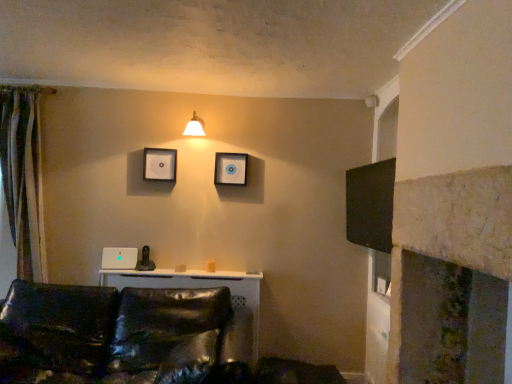
Question: In the image, is white matte picture frame at upper center, the first picture frame from the left, positioned in front of or behind shiny black leather couch at lower left?

Choices:
 (A) front
 (B) behind

Answer: (B)

Question: Choose the correct answer: Is white matte picture frame at upper center, arranged as the second picture frame when viewed from the right, inside shiny black leather couch at lower left or outside it?

Choices:
 (A) outside
 (B) inside

Answer: (A)

Question: Considering the real-world distances, which object is farthest from the shiny black leather couch at lower left?

Choices:
 (A) white glossy wall sconce at upper center
 (B) white glossy picture frame at upper center, the first picture frame from the right
 (C) white matte picture frame at upper center, arranged as the second picture frame when viewed from the right
 (D) silky beige curtain at left

Answer: (A)

Question: Which of these objects is positioned farthest from the silky beige curtain at left?

Choices:
 (A) shiny black leather couch at lower left
 (B) white glossy picture frame at upper center, arranged as the second picture frame when viewed from the left
 (C) white glossy wall sconce at upper center
 (D) white matte picture frame at upper center, the first picture frame from the left

Answer: (B)